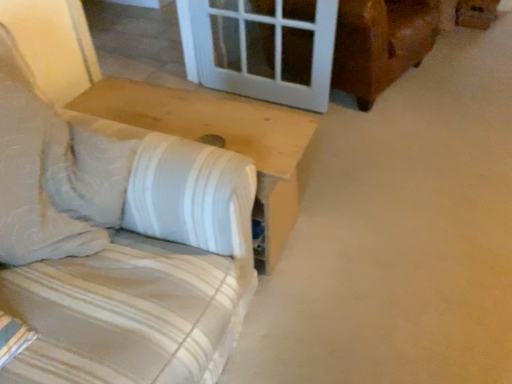
Find the location of a particular element. Image resolution: width=512 pixels, height=384 pixels. vacant region in front of brown cardboard box at upper right is located at coordinates (482, 38).